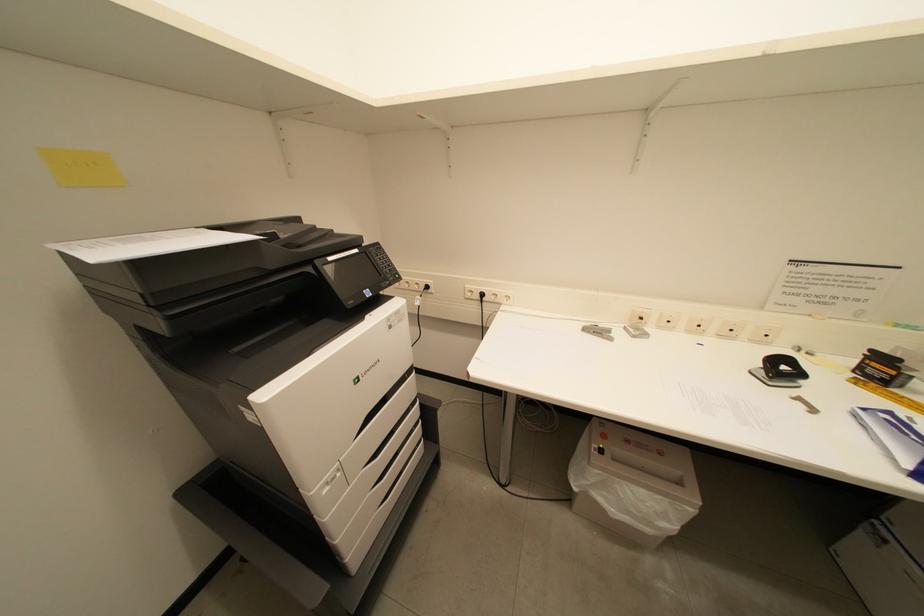
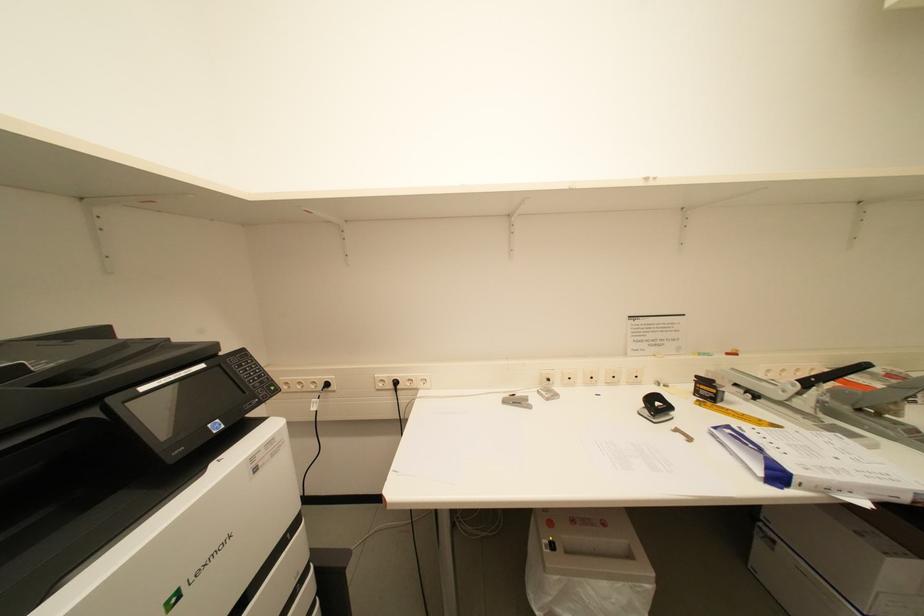
What movement of the cameraman would produce the second image?

The cameraman walked toward right, forward.